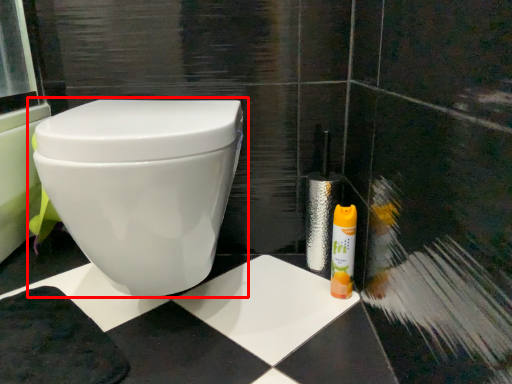
Question: In this image, where is toilet (annotated by the red box) located relative to cleaning product?

Choices:
 (A) right
 (B) left

Answer: (B)